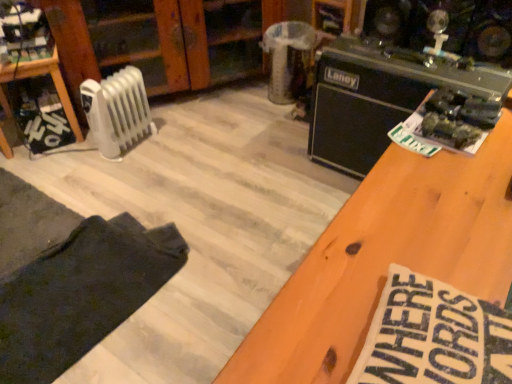
Question: Is dark cotton pants at lower left bigger than white plastic radiator at left?

Choices:
 (A) no
 (B) yes

Answer: (B)

Question: Considering the relative sizes of dark cotton pants at lower left and white plastic radiator at left in the image provided, is dark cotton pants at lower left wider than white plastic radiator at left?

Choices:
 (A) yes
 (B) no

Answer: (A)

Question: From the image's perspective, is dark cotton pants at lower left below white plastic radiator at left?

Choices:
 (A) no
 (B) yes

Answer: (B)

Question: Considering the relative sizes of dark cotton pants at lower left and white plastic radiator at left in the image provided, is dark cotton pants at lower left thinner than white plastic radiator at left?

Choices:
 (A) yes
 (B) no

Answer: (B)

Question: Is dark cotton pants at lower left closer to camera compared to white plastic radiator at left?

Choices:
 (A) yes
 (B) no

Answer: (A)

Question: Does dark cotton pants at lower left come behind white plastic radiator at left?

Choices:
 (A) no
 (B) yes

Answer: (A)

Question: Would you say black matte amplifier at upper right contains white plastic radiator at left?

Choices:
 (A) no
 (B) yes

Answer: (A)

Question: Is black matte amplifier at upper right positioned behind white plastic radiator at left?

Choices:
 (A) no
 (B) yes

Answer: (A)

Question: From the image's perspective, would you say black matte amplifier at upper right is shown under white plastic radiator at left?

Choices:
 (A) no
 (B) yes

Answer: (B)

Question: From the image's perspective, is black matte amplifier at upper right on top of white plastic radiator at left?

Choices:
 (A) yes
 (B) no

Answer: (B)

Question: Does black matte amplifier at upper right have a larger size compared to white plastic radiator at left?

Choices:
 (A) no
 (B) yes

Answer: (B)

Question: Is black matte amplifier at upper right positioned with its back to white plastic radiator at left?

Choices:
 (A) yes
 (B) no

Answer: (B)

Question: Does dark cotton pants at lower left have a smaller size compared to wooden shelf at left?

Choices:
 (A) no
 (B) yes

Answer: (B)